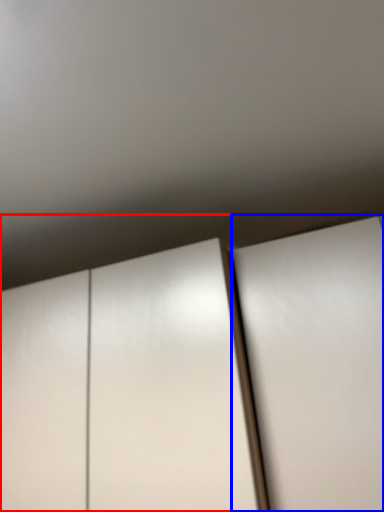
Question: Which object is closer to the camera taking this photo, cupboard (highlighted by a red box) or door (highlighted by a blue box)?

Choices:
 (A) cupboard
 (B) door

Answer: (B)